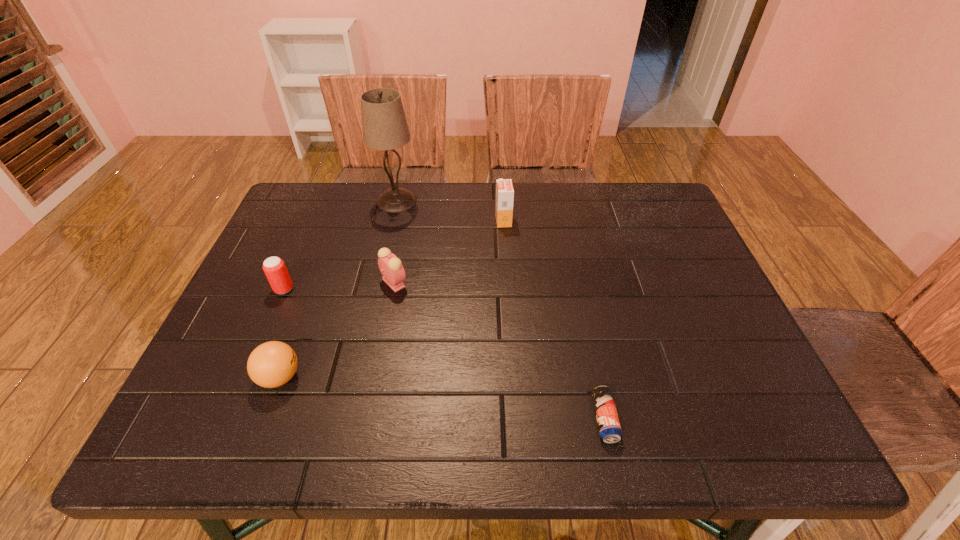
The width and height of the screenshot is (960, 540). Identify the location of vacant space that satisfies the following two spatial constraints: 1. on the face of the rightmost object; 2. on the left side of the alarm clock. (368, 418).

Locate an element on the screen. vacant point that satisfies the following two spatial constraints: 1. on the side with brand of the rightmost object; 2. on the left side of the second object from left to right is located at coordinates (265, 418).